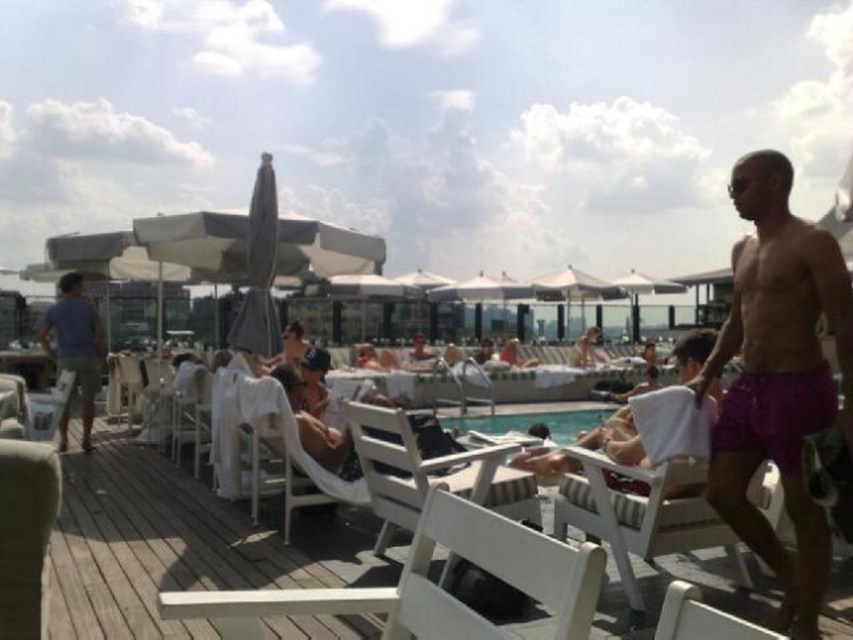
Question: Which object appears closest to the camera in this image?

Choices:
 (A) purple fabric towel at center
 (B) white fabric umbrella at upper center
 (C) white wood deck at center

Answer: (C)

Question: Which object is closer to the camera taking this photo?

Choices:
 (A) white plastic beach chair at lower right
 (B) gray fabric umbrella at center
 (C) blue denim shorts at left
 (D) white striped plastic beach chair at center

Answer: (A)

Question: Is white striped plastic beach chair at center wider than white plastic chair at center?

Choices:
 (A) no
 (B) yes

Answer: (B)

Question: Which point is closer to the camera?

Choices:
 (A) (84, 396)
 (B) (10, 445)
 (C) (193, 433)
 (D) (494, 467)

Answer: (B)

Question: Can you confirm if purple fabric towel at center is positioned to the right of white plastic chair at center?

Choices:
 (A) yes
 (B) no

Answer: (A)

Question: Can you confirm if clear glass pool at center is positioned to the left of white fabric umbrella at upper center?

Choices:
 (A) no
 (B) yes

Answer: (B)